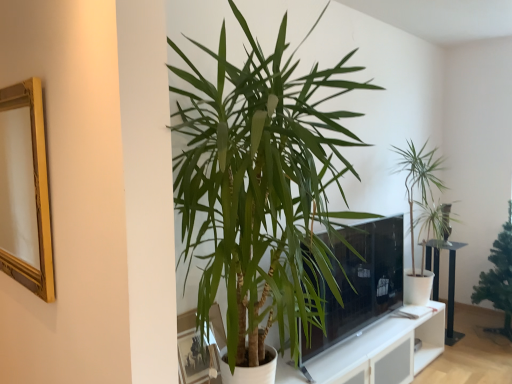
Question: Does green leafy plant at right, which appears as the first houseplant when viewed from the right, have a larger size compared to gold wood picture frame at left, the 2th picture frame in the bottom-to-top sequence?

Choices:
 (A) yes
 (B) no

Answer: (A)

Question: Would you say gold wood picture frame at left, the 2th picture frame in the bottom-to-top sequence, is part of green leafy plant at right, which is the third houseplant from front to back,'s contents?

Choices:
 (A) no
 (B) yes

Answer: (A)

Question: From the image's perspective, is green leafy plant at right, which is the 1th houseplant from back to front, under gold wood picture frame at left, the 2th picture frame in the bottom-to-top sequence?

Choices:
 (A) yes
 (B) no

Answer: (A)

Question: Can we say green leafy plant at right, which is the 1th houseplant from back to front, lies outside gold wood picture frame at left, arranged as the 1th picture frame when viewed from the left?

Choices:
 (A) yes
 (B) no

Answer: (A)

Question: Considering the relative positions of green leafy plant at right, which appears as the first houseplant when viewed from the right, and gold wood picture frame at left, arranged as the 1th picture frame when viewed from the top, in the image provided, is green leafy plant at right, which appears as the first houseplant when viewed from the right, to the right of gold wood picture frame at left, arranged as the 1th picture frame when viewed from the top, from the viewer's perspective?

Choices:
 (A) no
 (B) yes

Answer: (B)

Question: Considering the positions of gold wood picture frame at left, the 2th picture frame in the bottom-to-top sequence, and green leafy plant at center, arranged as the 1th houseplant when viewed from the left, in the image, is gold wood picture frame at left, the 2th picture frame in the bottom-to-top sequence, bigger or smaller than green leafy plant at center, arranged as the 1th houseplant when viewed from the left,?

Choices:
 (A) small
 (B) big

Answer: (A)

Question: In the image, is gold wood picture frame at left, positioned as the 2th picture frame in right-to-left order, positioned in front of or behind green leafy plant at center, which is the third houseplant in back-to-front order?

Choices:
 (A) front
 (B) behind

Answer: (B)

Question: Would you say gold wood picture frame at left, arranged as the 1th picture frame when viewed from the left, is to the left or to the right of green leafy plant at center, arranged as the 1th houseplant when viewed from the left, in the picture?

Choices:
 (A) left
 (B) right

Answer: (A)

Question: Considering the positions of gold wood picture frame at left, arranged as the 1th picture frame when viewed from the left, and green leafy plant at center, which is the third houseplant in back-to-front order, in the image, is gold wood picture frame at left, arranged as the 1th picture frame when viewed from the left, wider or thinner than green leafy plant at center, which is the third houseplant in back-to-front order,?

Choices:
 (A) thin
 (B) wide

Answer: (A)

Question: From a real-world perspective, is transparent glass door at center above or below matte glass picture frame at lower center, the 2th picture frame from the top?

Choices:
 (A) above
 (B) below

Answer: (A)

Question: Looking at the image, does transparent glass door at center seem bigger or smaller compared to matte glass picture frame at lower center, which appears as the 1th picture frame when ordered from the bottom?

Choices:
 (A) small
 (B) big

Answer: (B)

Question: Based on their positions, is transparent glass door at center located to the left or right of matte glass picture frame at lower center, acting as the second picture frame starting from the left?

Choices:
 (A) left
 (B) right

Answer: (B)

Question: Choose the correct answer: Is transparent glass door at center inside matte glass picture frame at lower center, which appears as the 1th picture frame when ordered from the bottom, or outside it?

Choices:
 (A) inside
 (B) outside

Answer: (B)

Question: From the image's perspective, relative to green leafy plant at right, the 2th houseplant in the left-to-right sequence, is black metal table at right above or below?

Choices:
 (A) below
 (B) above

Answer: (A)

Question: Is black metal table at right wider or thinner than green leafy plant at right, which is the second houseplant from back to front?

Choices:
 (A) thin
 (B) wide

Answer: (A)